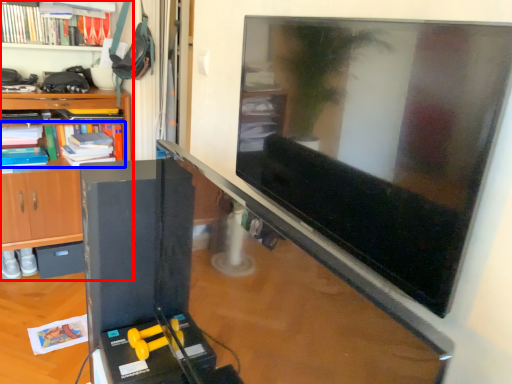
Question: Which object appears closest to the camera in this image, shelf (highlighted by a red box) or book (highlighted by a blue box)?

Choices:
 (A) shelf
 (B) book

Answer: (A)